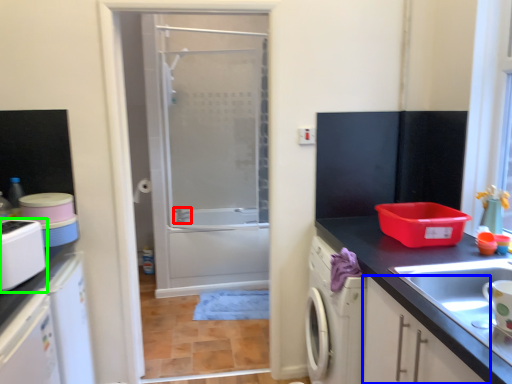
Question: Which object is the farthest from faucet (highlighted by a red box)? Choose among these: cabinetry (highlighted by a blue box) or appliance (highlighted by a green box).

Choices:
 (A) cabinetry
 (B) appliance

Answer: (A)